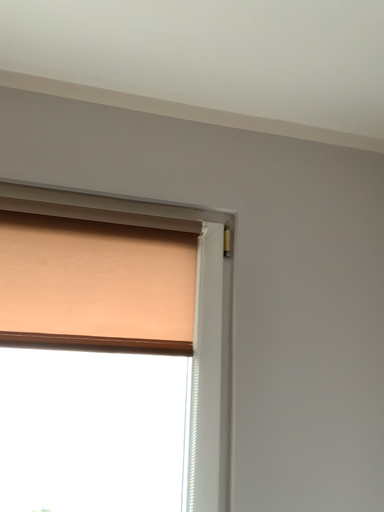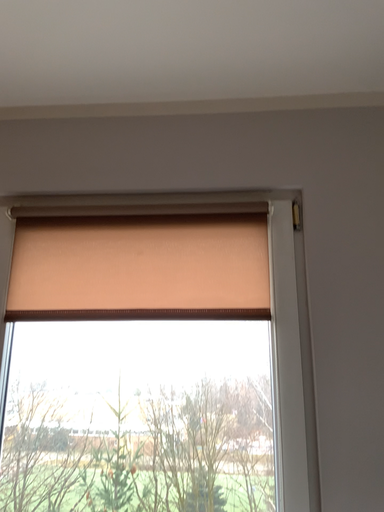
Question: Which way did the camera rotate in the video?

Choices:
 (A) rotated right
 (B) rotated left

Answer: (B)